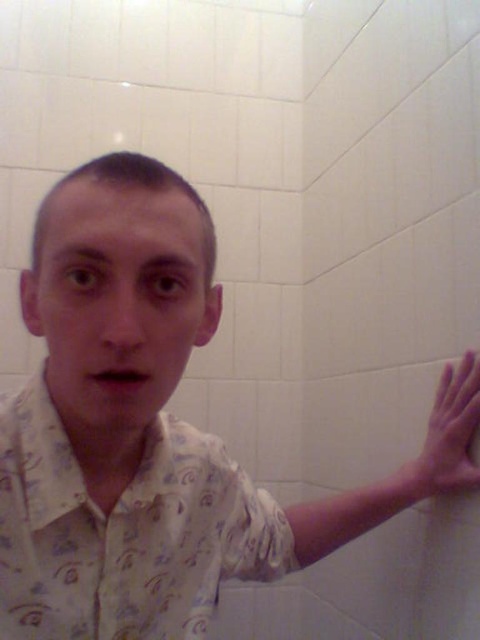
Question: Among these objects, which one is nearest to the camera?

Choices:
 (A) white printed shirt at center
 (B) pink flesh-toned hand at right

Answer: (A)

Question: Which object appears farthest from the camera in this image?

Choices:
 (A) pink flesh-toned hand at right
 (B) white printed shirt at center

Answer: (A)

Question: Is white printed shirt at center to the left of pink flesh-toned hand at right from the viewer's perspective?

Choices:
 (A) no
 (B) yes

Answer: (B)

Question: Which object appears closest to the camera in this image?

Choices:
 (A) white printed shirt at center
 (B) pink flesh-toned hand at right

Answer: (A)

Question: Does white printed shirt at center appear over pink flesh-toned hand at right?

Choices:
 (A) no
 (B) yes

Answer: (A)

Question: Is white printed shirt at center below pink flesh-toned hand at right?

Choices:
 (A) no
 (B) yes

Answer: (B)